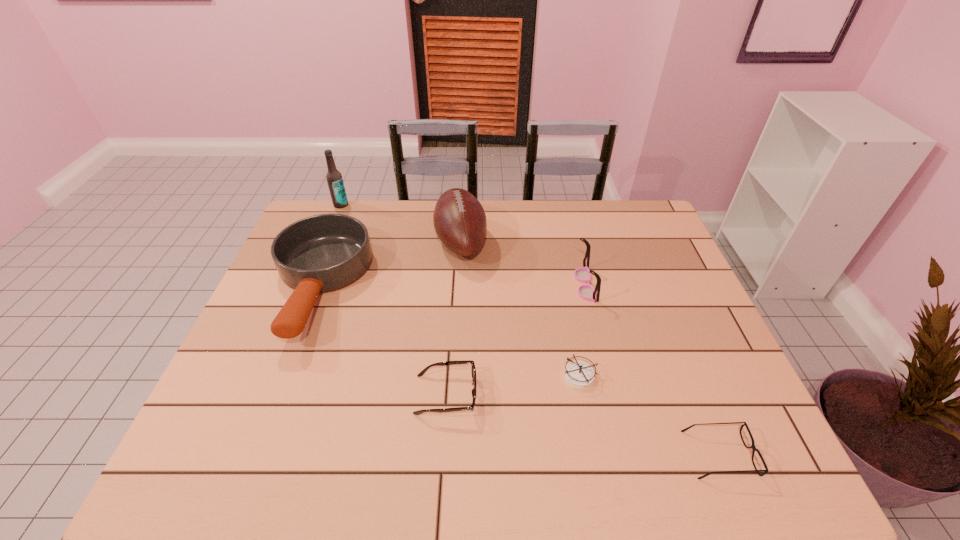
Find the location of `beer bottle`. beer bottle is located at coordinates [334, 178].

This screenshot has height=540, width=960. What are the coordinates of `the tallest object` in the screenshot? It's located at (334, 178).

The width and height of the screenshot is (960, 540). Find the location of `football (American)`. football (American) is located at coordinates (459, 219).

You are a GUI agent. You are given a task and a screenshot of the screen. Output one action in this format:
    pyautogui.click(x=<x>, y=<y>)
    Task: Click on the farthest spectacles
    Image resolution: width=960 pixels, height=540 pixels.
    Given the screenshot: What is the action you would take?
    pyautogui.click(x=586, y=292)

At what (x,y) coordinates should I click in order to perform the action: click on the second spectacles from right to left. Please return your answer as a coordinate pair (x, y). This screenshot has height=540, width=960. Looking at the image, I should click on (586, 292).

You are a GUI agent. You are given a task and a screenshot of the screen. Output one action in this format:
    pyautogui.click(x=<x>, y=<y>)
    Task: Click on the fourth tallest object
    
    Given the screenshot: What is the action you would take?
    pyautogui.click(x=322, y=253)

You are a GUI agent. You are given a task and a screenshot of the screen. Output one action in this format:
    pyautogui.click(x=<x>, y=<y>)
    Task: Click on the second nearest spectacles
    This screenshot has height=540, width=960.
    Given the screenshot: What is the action you would take?
    pyautogui.click(x=473, y=370)

The image size is (960, 540). In order to click on compass in this screenshot , I will do point(578,374).

Where is `the shortest object`? the shortest object is located at coordinates (752, 446).

Image resolution: width=960 pixels, height=540 pixels. In order to click on the rightmost object in this screenshot , I will do `click(752, 446)`.